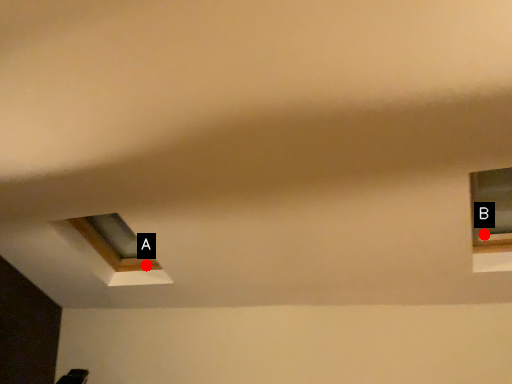
Question: Two points are circled on the image, labeled by A and B beside each circle. Which point is closer to the camera taking this photo?

Choices:
 (A) A is closer
 (B) B is closer

Answer: (B)